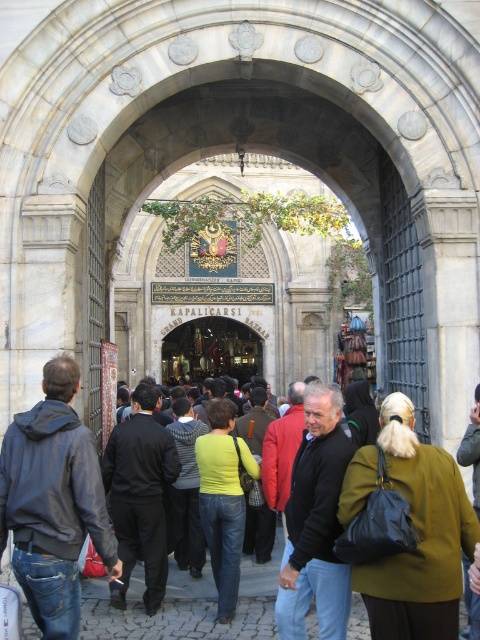
Question: Which point appears closest to the camera in this image?

Choices:
 (A) (305, 458)
 (B) (476, 504)
 (C) (387, 474)

Answer: (C)

Question: Is green fabric crowd at center to the right of black cotton pants at center from the viewer's perspective?

Choices:
 (A) no
 (B) yes

Answer: (B)

Question: Which of the following is the farthest from the observer?

Choices:
 (A) pos(183,429)
 (B) pos(245,532)
 (C) pos(248,602)
 (D) pos(228,410)

Answer: (A)

Question: Observing the image, what is the correct spatial positioning of green matte shirt at center in reference to green wool coat at center?

Choices:
 (A) below
 (B) above

Answer: (A)

Question: Among these objects, which one is farthest from the camera?

Choices:
 (A) black matte jacket at center
 (B) green fabric crowd at center

Answer: (B)

Question: Can you confirm if olive-green fabric coat at center is wider than yellow-green sweater at center?

Choices:
 (A) no
 (B) yes

Answer: (B)